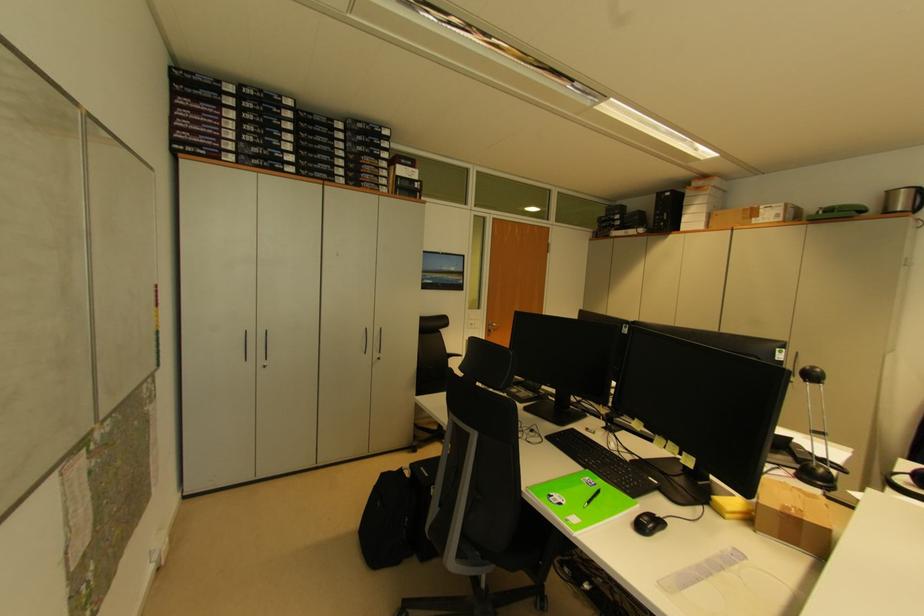
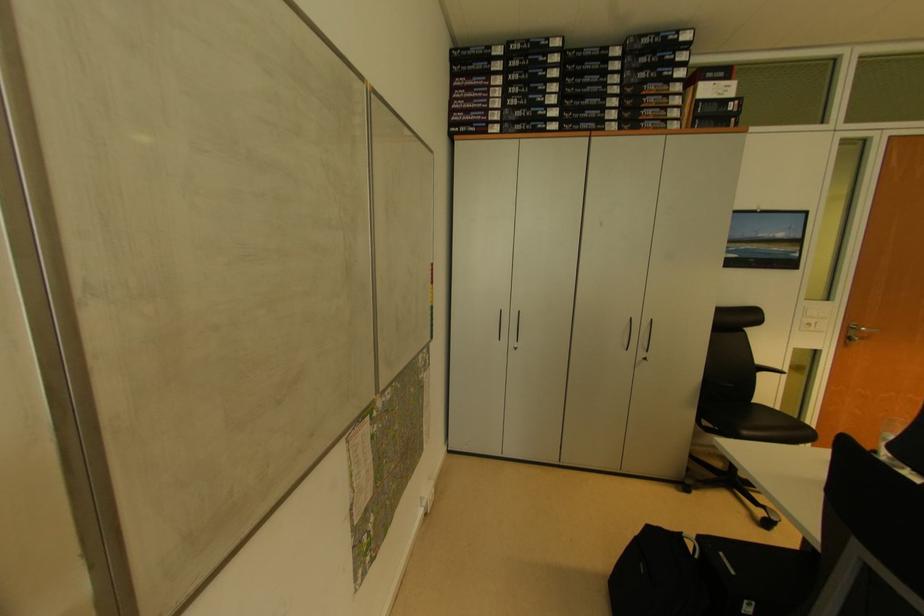
Locate, in the second image, the point that corresponds to point 473,328 in the first image.

(811, 328)